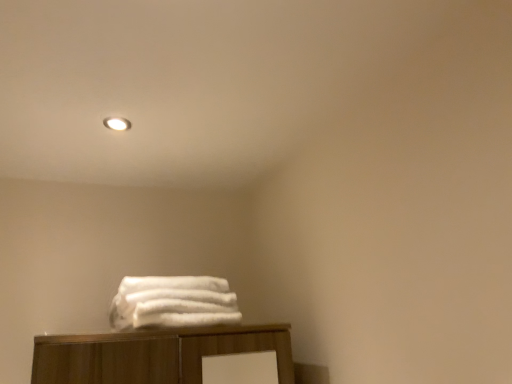
Question: Does matte white light fixture at upper center lie behind white fluffy towels at center?

Choices:
 (A) no
 (B) yes

Answer: (B)

Question: Is matte white light fixture at upper center not within white fluffy towels at center?

Choices:
 (A) yes
 (B) no

Answer: (A)

Question: From the image's perspective, is matte white light fixture at upper center below white fluffy towels at center?

Choices:
 (A) no
 (B) yes

Answer: (A)

Question: Would you say matte white light fixture at upper center contains white fluffy towels at center?

Choices:
 (A) no
 (B) yes

Answer: (A)

Question: Does matte white light fixture at upper center have a greater height compared to white fluffy towels at center?

Choices:
 (A) yes
 (B) no

Answer: (B)

Question: Considering the relative positions of matte white light fixture at upper center and white fluffy towels at center in the image provided, is matte white light fixture at upper center in front of white fluffy towels at center?

Choices:
 (A) yes
 (B) no

Answer: (B)

Question: Can you confirm if white fluffy towels at center is positioned to the left of matte white light fixture at upper center?

Choices:
 (A) no
 (B) yes

Answer: (A)

Question: Is the position of white fluffy towels at center less distant than that of matte white light fixture at upper center?

Choices:
 (A) yes
 (B) no

Answer: (A)

Question: Is white fluffy towels at center further to camera compared to matte white light fixture at upper center?

Choices:
 (A) no
 (B) yes

Answer: (A)

Question: Considering the relative sizes of white fluffy towels at center and matte white light fixture at upper center in the image provided, is white fluffy towels at center bigger than matte white light fixture at upper center?

Choices:
 (A) no
 (B) yes

Answer: (B)

Question: Is white fluffy towels at center not near matte white light fixture at upper center?

Choices:
 (A) yes
 (B) no

Answer: (B)

Question: Can matte white light fixture at upper center be found inside white fluffy towels at center?

Choices:
 (A) yes
 (B) no

Answer: (B)

Question: Is white fluffy towels at center inside or outside of matte white light fixture at upper center?

Choices:
 (A) outside
 (B) inside

Answer: (A)